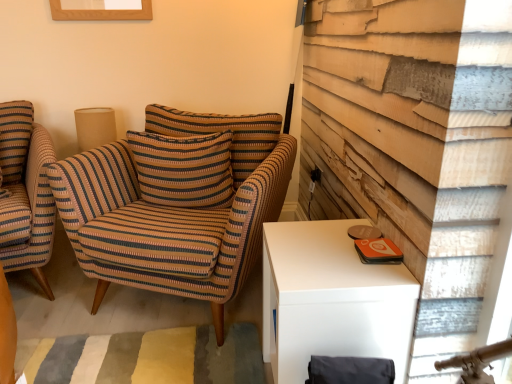
Question: Is burlap lampshade at upper left closer to the viewer compared to striped fabric armchair at center, acting as the first chair starting from the right?

Choices:
 (A) no
 (B) yes

Answer: (A)

Question: From the image's perspective, is burlap lampshade at upper left located beneath striped fabric armchair at center, acting as the first chair starting from the right?

Choices:
 (A) no
 (B) yes

Answer: (A)

Question: Considering the relative sizes of burlap lampshade at upper left and striped fabric armchair at center, acting as the first chair starting from the right, in the image provided, is burlap lampshade at upper left shorter than striped fabric armchair at center, acting as the first chair starting from the right,?

Choices:
 (A) no
 (B) yes

Answer: (B)

Question: Are burlap lampshade at upper left and striped fabric armchair at center, acting as the first chair starting from the right, beside each other?

Choices:
 (A) yes
 (B) no

Answer: (B)

Question: Can you confirm if burlap lampshade at upper left is positioned to the left of striped fabric armchair at center, the second chair when ordered from left to right?

Choices:
 (A) yes
 (B) no

Answer: (A)

Question: In terms of width, does burlap lampshade at upper left look wider or thinner when compared to striped fabric armchair at center, acting as the first chair starting from the right?

Choices:
 (A) thin
 (B) wide

Answer: (A)

Question: Does point (93, 144) appear closer or farther from the camera than point (120, 264)?

Choices:
 (A) farther
 (B) closer

Answer: (A)

Question: Is burlap lampshade at upper left situated inside striped fabric armchair at center, the second chair when ordered from left to right, or outside?

Choices:
 (A) inside
 (B) outside

Answer: (B)

Question: From their relative heights in the image, would you say burlap lampshade at upper left is taller or shorter than striped fabric armchair at center, acting as the first chair starting from the right?

Choices:
 (A) short
 (B) tall

Answer: (A)

Question: Is striped fabric armchair at left, arranged as the first chair when viewed from the left, wider or thinner than striped fabric pillow at center?

Choices:
 (A) thin
 (B) wide

Answer: (B)

Question: From a real-world perspective, is striped fabric armchair at left, arranged as the first chair when viewed from the left, above or below striped fabric pillow at center?

Choices:
 (A) above
 (B) below

Answer: (B)

Question: Considering the positions of point (10, 157) and point (205, 167), is point (10, 157) closer or farther from the camera than point (205, 167)?

Choices:
 (A) closer
 (B) farther

Answer: (B)

Question: Visually, is striped fabric armchair at left, arranged as the first chair when viewed from the left, positioned to the left or to the right of striped fabric pillow at center?

Choices:
 (A) right
 (B) left

Answer: (B)

Question: Visually, is striped fabric armchair at center, the second chair when ordered from left to right, positioned to the left or to the right of burlap lampshade at upper left?

Choices:
 (A) left
 (B) right

Answer: (B)

Question: In terms of width, does striped fabric armchair at center, the second chair when ordered from left to right, look wider or thinner when compared to burlap lampshade at upper left?

Choices:
 (A) thin
 (B) wide

Answer: (B)